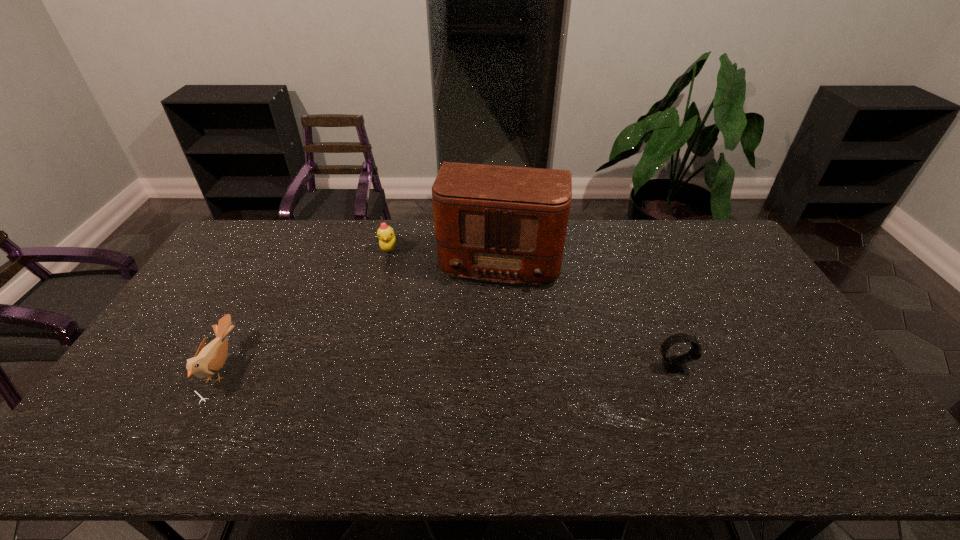
Locate an element on the screen. The image size is (960, 540). the leftmost object is located at coordinates (208, 360).

What are the coordinates of `watch` in the screenshot? It's located at coord(672,364).

Where is `the tallest object`? the tallest object is located at coordinates tap(507, 224).

This screenshot has height=540, width=960. I want to click on radio receiver, so click(507, 224).

Where is `duckling`? duckling is located at coordinates (387, 241).

Where is `free space located at the beak of the leftmost object`? The height and width of the screenshot is (540, 960). free space located at the beak of the leftmost object is located at coordinates (146, 368).

Where is `vacant space situated at the beak of the leftmost object`? The width and height of the screenshot is (960, 540). vacant space situated at the beak of the leftmost object is located at coordinates (168, 368).

Find the location of a particular element. vacant space positioned 0.180m at the beak of the leftmost object is located at coordinates (142, 368).

Locate an element on the screen. This screenshot has height=540, width=960. vacant space located 0.260m on the face of the rightmost object is located at coordinates (786, 366).

Locate an element on the screen. free point located on the front panel of the radio receiver is located at coordinates (484, 337).